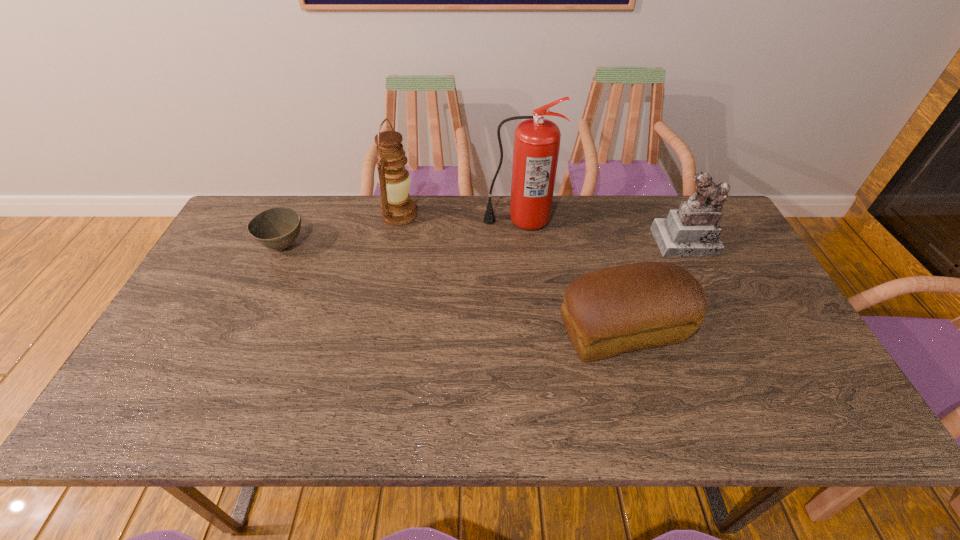
I want to click on free point between the nearest object and the bowl, so click(453, 289).

Where is `vacant region between the shortest object and the rightmost object`? vacant region between the shortest object and the rightmost object is located at coordinates (485, 244).

The width and height of the screenshot is (960, 540). Find the location of `vacant area that lies between the bowl and the tallest object`. vacant area that lies between the bowl and the tallest object is located at coordinates (401, 234).

Where is `free point between the rightmost object and the fire extinguisher`? Image resolution: width=960 pixels, height=540 pixels. free point between the rightmost object and the fire extinguisher is located at coordinates (602, 232).

At what (x,y) coordinates should I click in order to perform the action: click on vacant space that is in between the oil lamp and the fourth tallest object. Please return your answer as a coordinate pair (x, y). Looking at the image, I should click on (511, 273).

Choose which object is the fourth nearest neighbor to the leftmost object. Please provide its 2D coordinates. Your answer should be formatted as a tuple, i.e. [(x, y)], where the tuple contains the x and y coordinates of a point satisfying the conditions above.

[(691, 231)]

Identify which object is the second closest to the bread. Please provide its 2D coordinates. Your answer should be formatted as a tuple, i.e. [(x, y)], where the tuple contains the x and y coordinates of a point satisfying the conditions above.

[(537, 140)]

Identify the location of free spot that satisfies the following two spatial constraints: 1. on the front side of the second shortest object; 2. on the right side of the bowl. (245, 332).

Where is `vacant space that satisfies the following two spatial constraints: 1. on the front side of the second object from left to right; 2. on the left side of the nearest object`? vacant space that satisfies the following two spatial constraints: 1. on the front side of the second object from left to right; 2. on the left side of the nearest object is located at coordinates (375, 332).